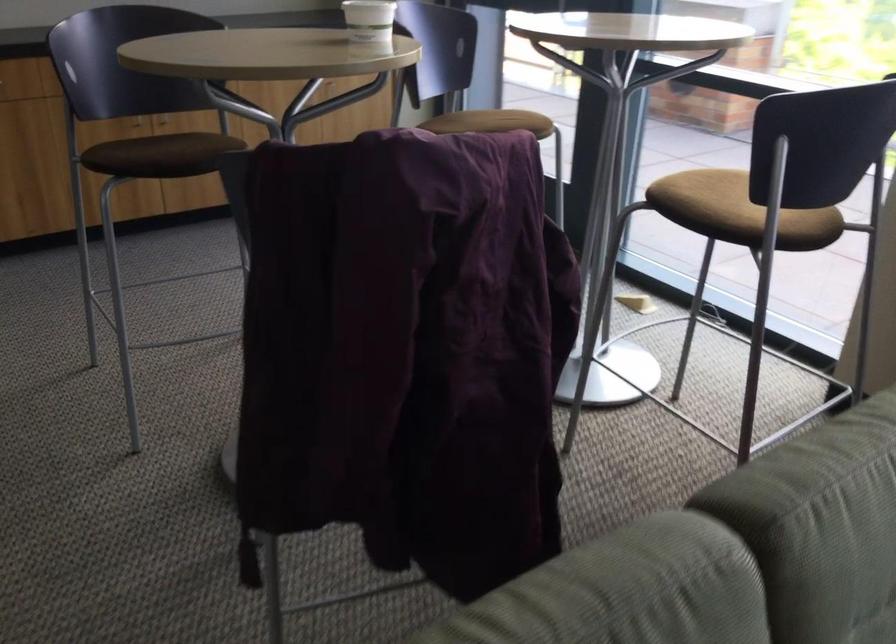
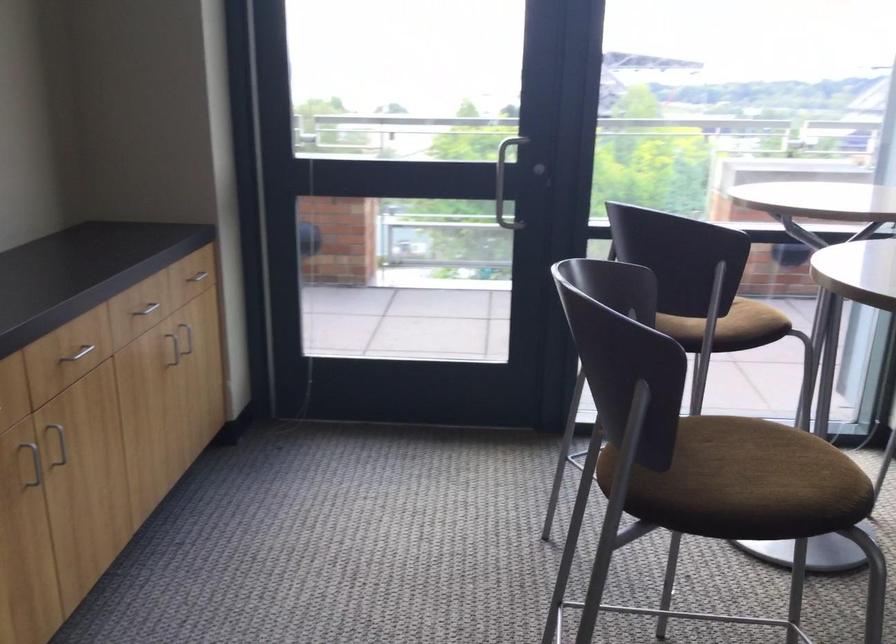
Find the pixel in the second image that matches point (510, 129) in the first image.

(748, 319)